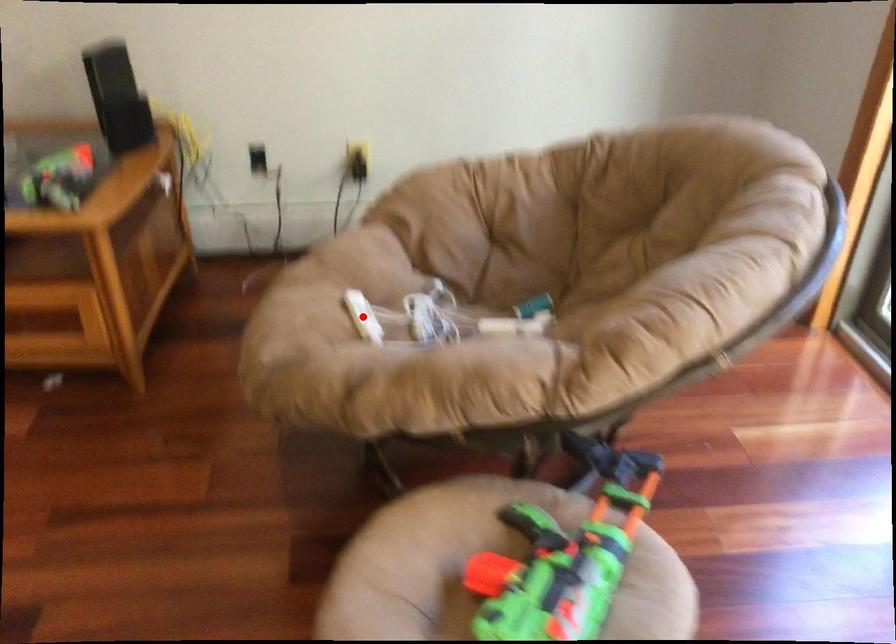
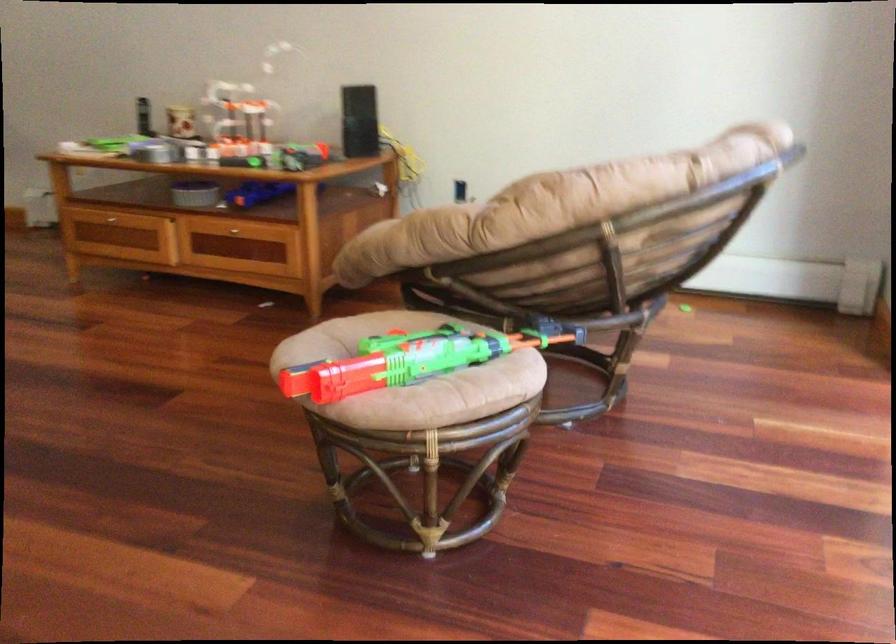
Question: I am providing you with two images of the same scene from different viewpoints. A red point is marked on the first image. Is the red point's position out of view in image 2?

Choices:
 (A) Yes
 (B) No

Answer: (A)